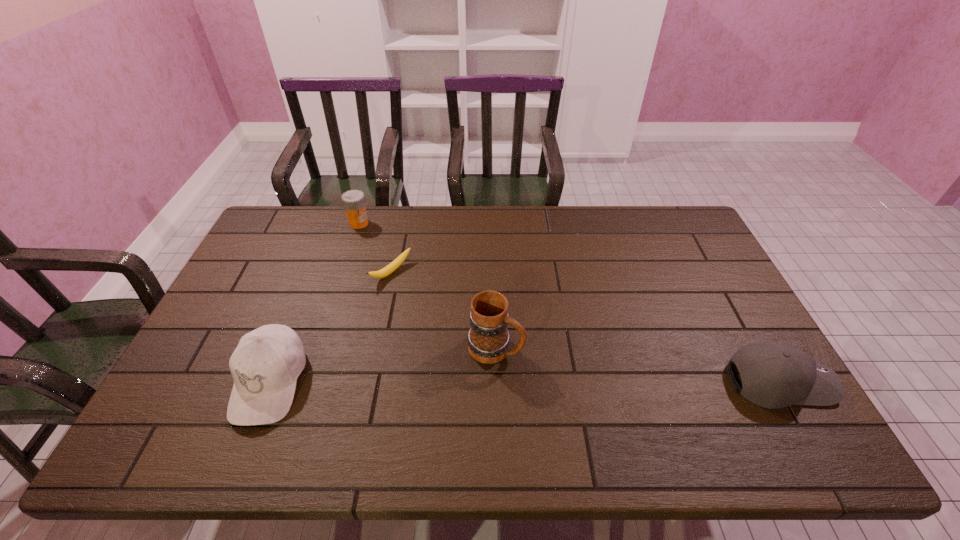
The height and width of the screenshot is (540, 960). Find the location of `vacant space that satisfies the following two spatial constraints: 1. on the front side of the mug; 2. on the left side of the farthest object`. vacant space that satisfies the following two spatial constraints: 1. on the front side of the mug; 2. on the left side of the farthest object is located at coordinates (319, 347).